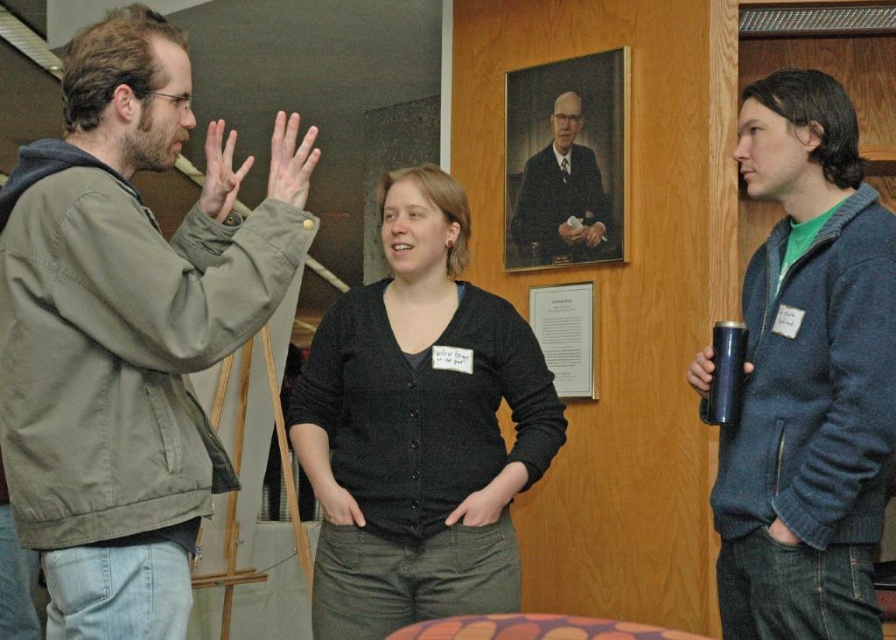
Does blue fleece jacket at right appear under metallic blue cup at right?

No, blue fleece jacket at right is not below metallic blue cup at right.

Between point (882, 240) and point (705, 371), which one is positioned behind?

The point (705, 371) is more distant.

Identify the location of blue fleece jacket at right. (808, 376).

Is matte gray hand at upper left taller than metallic blue cup at right?

Yes, matte gray hand at upper left is taller than metallic blue cup at right.

Is matte gray hand at upper left further to camera compared to metallic blue cup at right?

No, matte gray hand at upper left is in front of metallic blue cup at right.

Measure the distance between matte gray hand at upper left and camera.

The distance of matte gray hand at upper left from camera is 1.81 meters.

Where is `matte gray hand at upper left`? matte gray hand at upper left is located at coordinates (220, 172).

Can you confirm if matte khaki jacket at left is thinner than blue fleece jacket at right?

Incorrect, matte khaki jacket at left's width is not less than blue fleece jacket at right's.

Image resolution: width=896 pixels, height=640 pixels. Describe the element at coordinates (121, 337) in the screenshot. I see `matte khaki jacket at left` at that location.

This screenshot has height=640, width=896. Find the location of `matte khaki jacket at left`. matte khaki jacket at left is located at coordinates (121, 337).